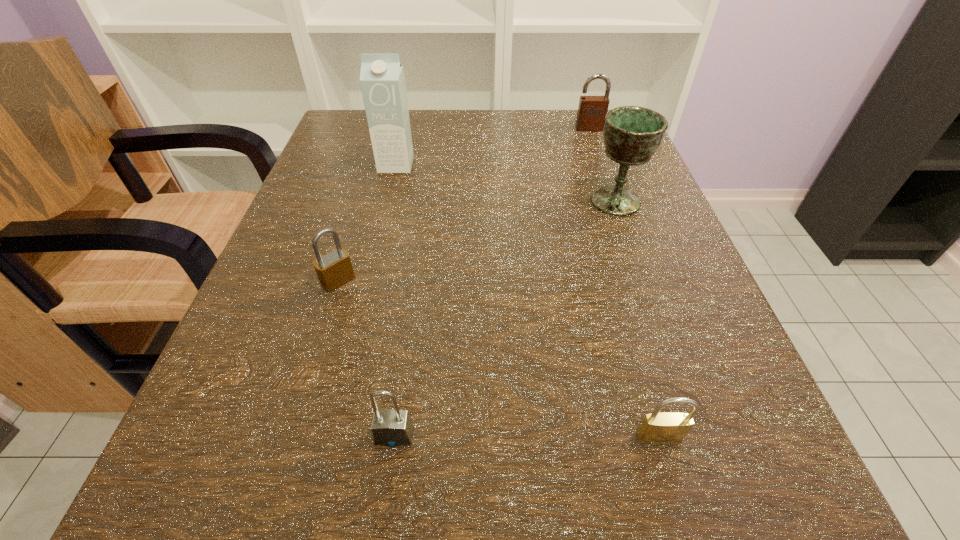
Image resolution: width=960 pixels, height=540 pixels. Identify the location of the second farthest object. (382, 80).

Locate an element on the screen. The image size is (960, 540). the tallest object is located at coordinates (382, 80).

The height and width of the screenshot is (540, 960). What are the coordinates of `the second tallest object` in the screenshot? It's located at (632, 134).

At what (x,y) coordinates should I click in order to perform the action: click on chalice. Please return your answer as a coordinate pair (x, y). Looking at the image, I should click on [632, 134].

Where is `the farthest padlock`? The width and height of the screenshot is (960, 540). the farthest padlock is located at coordinates (592, 110).

The width and height of the screenshot is (960, 540). I want to click on the fourth shortest object, so click(x=592, y=110).

Locate an element on the screen. the second farthest padlock is located at coordinates (333, 269).

Locate an element on the screen. This screenshot has height=540, width=960. the fourth farthest object is located at coordinates (333, 269).

Locate an element on the screen. The width and height of the screenshot is (960, 540). the third object from left to right is located at coordinates (391, 427).

Where is `free region located on the front label of the fifth nearest object`? The width and height of the screenshot is (960, 540). free region located on the front label of the fifth nearest object is located at coordinates (359, 315).